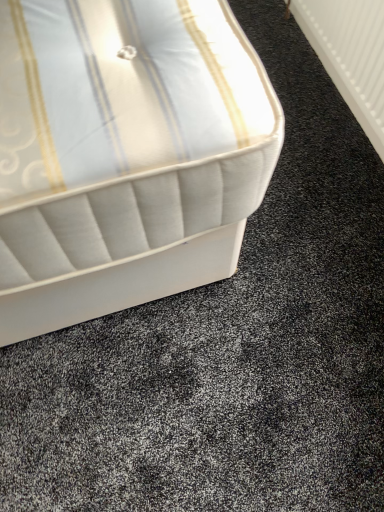
Question: Is white fabric bed at upper left wider or thinner than white plastic radiator at upper right?

Choices:
 (A) wide
 (B) thin

Answer: (A)

Question: Based on their sizes in the image, would you say white fabric bed at upper left is bigger or smaller than white plastic radiator at upper right?

Choices:
 (A) big
 (B) small

Answer: (A)

Question: Is point 137,89 closer or farther from the camera than point 332,53?

Choices:
 (A) farther
 (B) closer

Answer: (B)

Question: Considering the positions of point (367, 11) and point (208, 249), is point (367, 11) closer or farther from the camera than point (208, 249)?

Choices:
 (A) closer
 (B) farther

Answer: (B)

Question: In the image, is white plastic radiator at upper right on the left side or the right side of white fabric bed at upper left?

Choices:
 (A) left
 (B) right

Answer: (B)

Question: From a real-world perspective, is white plastic radiator at upper right physically located above or below white fabric bed at upper left?

Choices:
 (A) below
 (B) above

Answer: (B)

Question: From the image's perspective, relative to white fabric bed at upper left, is white plastic radiator at upper right above or below?

Choices:
 (A) above
 (B) below

Answer: (A)